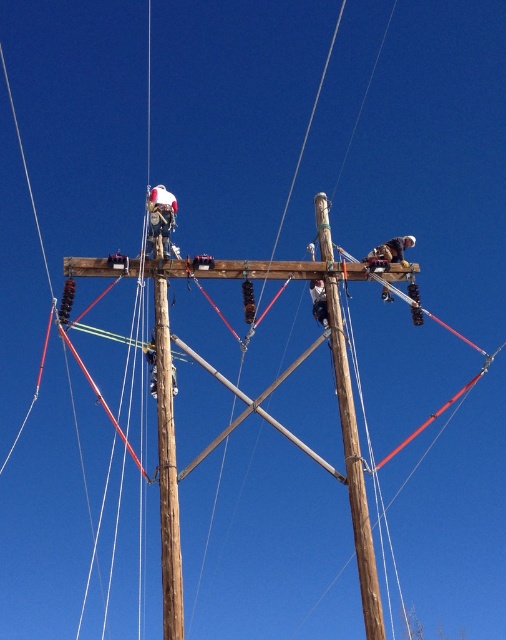
You are a safety inspector reviewing this image. You notice the brown wooden telegraph pole at center and the white fabric construction worker at upper left. Which object is taller in the image?

The brown wooden telegraph pole at center is taller than the white fabric construction worker at upper left.